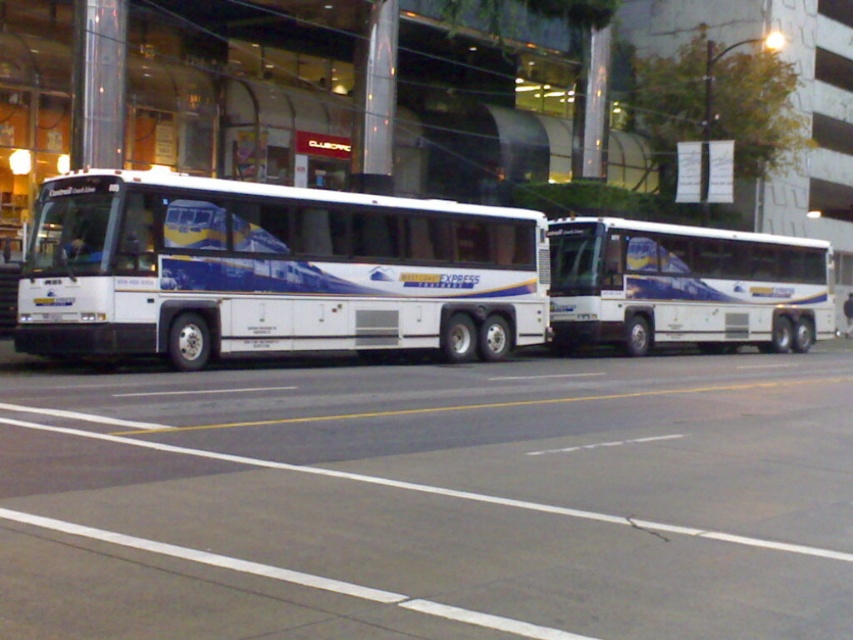
You are a pedestrian standing on the sidewalk and see the white glossy bus at center and the dark blue fabric couple at center. Which object takes up more space in the image?

The white glossy bus at center is bigger than the dark blue fabric couple at center, so it takes up more space in the image.

You are a pedestrian standing on the sidewalk next to the white glossy bus at left and the dark blue fabric couple at center. Which object is nearer to you?

The white glossy bus at left is closer to the viewer than the dark blue fabric couple at center, so the white glossy bus at left is nearer to you.